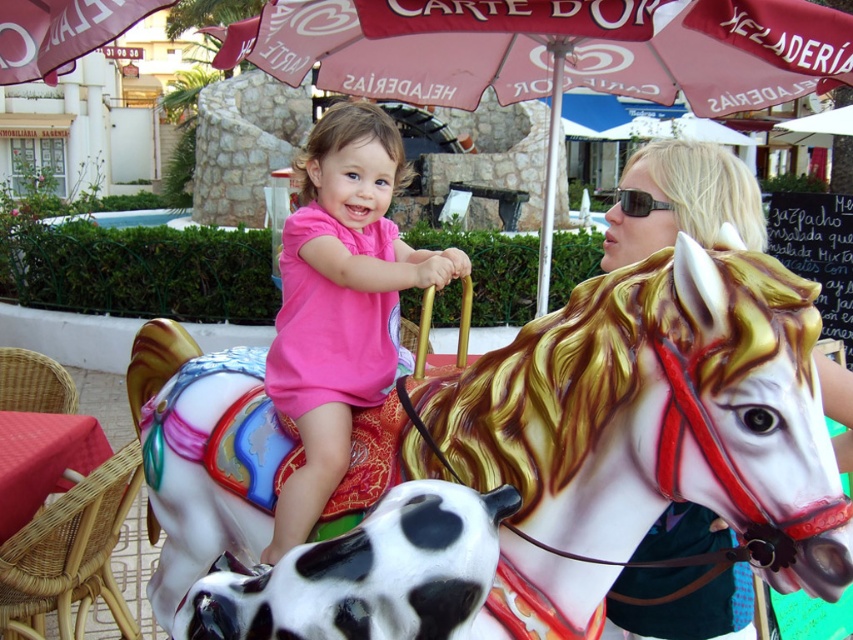
You are a parent trying to decide which horse to choose for your child. The painted wood horse at center and the matte white horse at upper right are both available. Which horse is taller?

The painted wood horse at center is much taller than the matte white horse at upper right, so the painted wood horse at center is the taller one.

You are standing in the amusement park and see the painted wood horse at center and the matte pink umbrella at upper center. Which object is closer to your left side?

The painted wood horse at center is to the left of matte pink umbrella at upper center, so it is closer to your left side.

You are standing in the amusement park and want to take a photo of the painted wood horse at center and the matte white horse at upper right. Which horse should you focus on first to ensure both are in the frame?

You should focus on the painted wood horse at center first because it is closer to you, so adjusting the camera to include it will naturally include the matte white horse at upper right in the background.